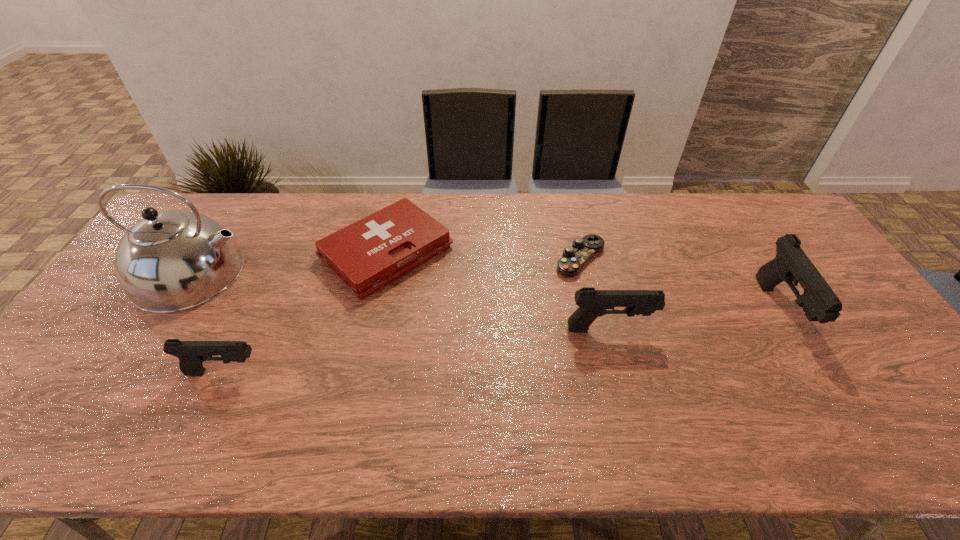
To make them evenly spaced by inserting another pistol among them, please locate a free space for this new pistol. Please provide its 2D coordinates. Your answer should be formatted as a tuple, i.e. [(x, y)], where the tuple contains the x and y coordinates of a point satisfying the conditions above.

[(424, 350)]